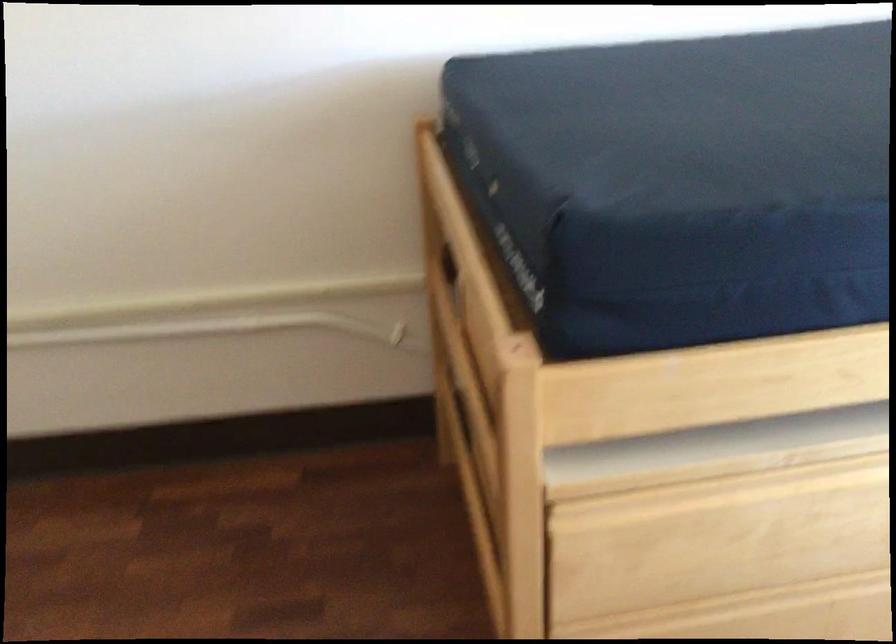
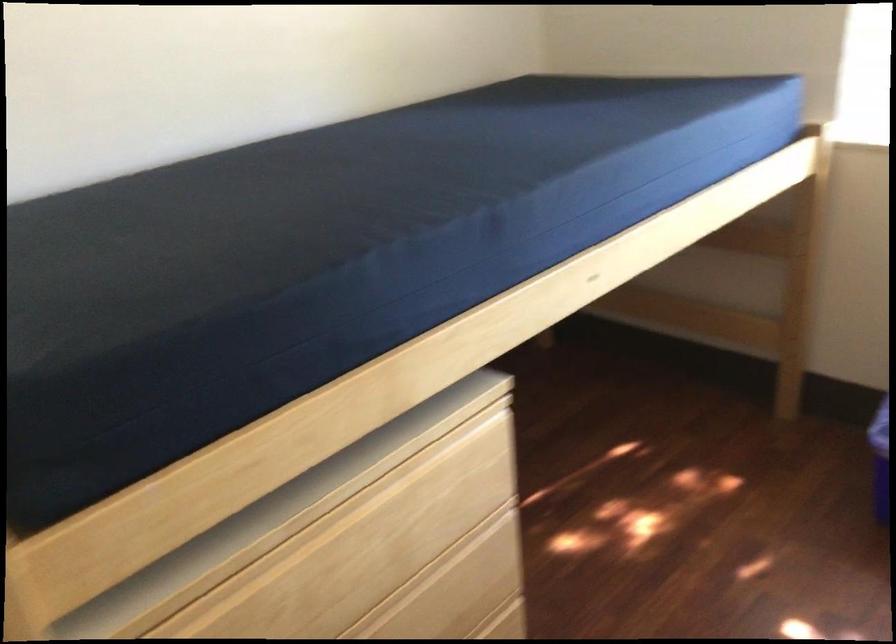
Locate, in the second image, the point that corresponds to the point at 651,488 in the first image.

(186, 611)